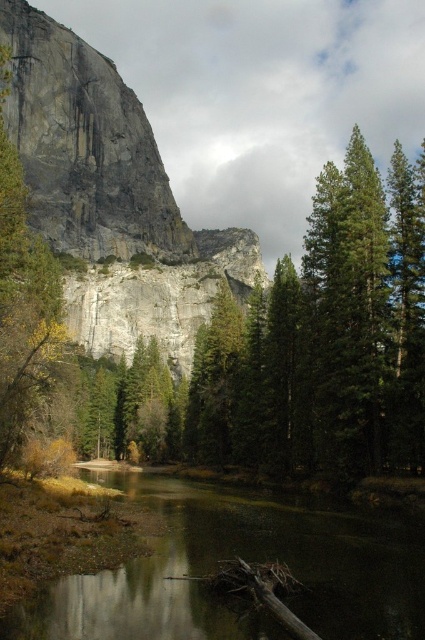
Can you confirm if gray rock cliff at upper center is positioned to the left of green matte tree at left?

Incorrect, gray rock cliff at upper center is not on the left side of green matte tree at left.

Can you confirm if gray rock cliff at upper center is thinner than green matte tree at left?

Incorrect, gray rock cliff at upper center's width is not less than green matte tree at left's.

Between point (133, 336) and point (2, 186), which one is positioned behind?

Positioned behind is point (133, 336).

You are a GUI agent. You are given a task and a screenshot of the screen. Output one action in this format:
    pyautogui.click(x=<x>, y=<y>)
    Task: Click on the gray rock cliff at upper center
    
    Given the screenshot: What is the action you would take?
    pyautogui.click(x=110, y=195)

Is point (95, 291) closer to camera compared to point (73, 593)?

That is False.

Describe the element at coordinates (110, 195) in the screenshot. The width and height of the screenshot is (425, 640). I see `gray rock cliff at upper center` at that location.

Identify the location of gray rock cliff at upper center. (110, 195).

Can you confirm if green smooth water at center is positioned to the right of green matte tree at left?

Indeed, green smooth water at center is positioned on the right side of green matte tree at left.

Is point (156, 621) behind point (17, 204)?

No, (156, 621) is closer to viewer.

Locate an element on the screen. The image size is (425, 640). green smooth water at center is located at coordinates (246, 561).